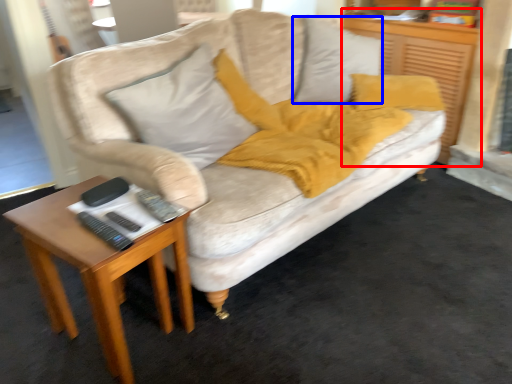
Question: Which of the following is the closest to the observer, dresser (highlighted by a red box) or pillow (highlighted by a blue box)?

Choices:
 (A) dresser
 (B) pillow

Answer: (B)